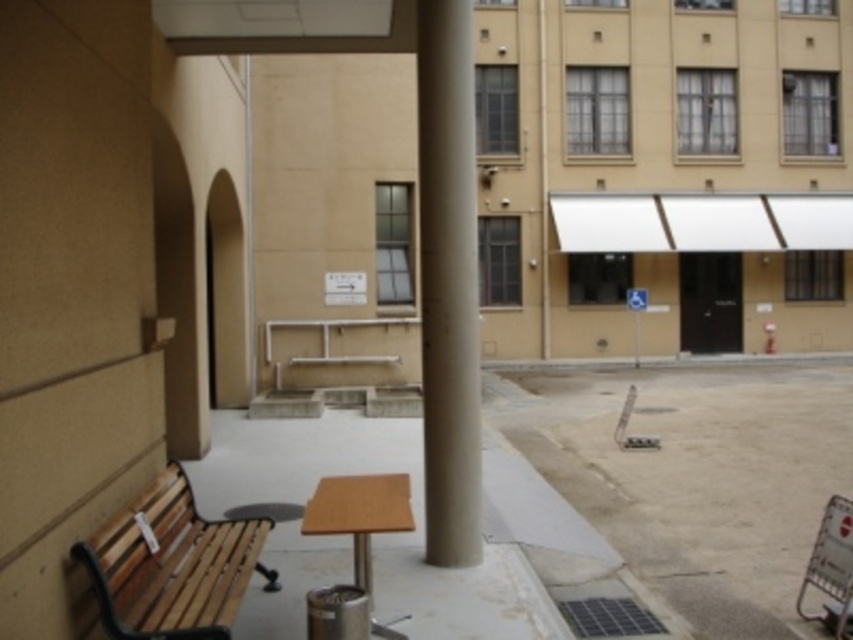
Question: Which of the following is the farthest from the observer?

Choices:
 (A) (387, 529)
 (B) (140, 579)

Answer: (B)

Question: Can you confirm if smooth concrete pavement at center is positioned to the right of smooth concrete pillar at center?

Choices:
 (A) yes
 (B) no

Answer: (A)

Question: Among these objects, which one is farthest from the camera?

Choices:
 (A) wooden park bench at lower left
 (B) smooth concrete pavement at center

Answer: (B)

Question: Is wooden park bench at lower left smaller than wooden table at center?

Choices:
 (A) yes
 (B) no

Answer: (A)

Question: Is smooth concrete pillar at center closer to camera compared to wooden park bench at lower left?

Choices:
 (A) no
 (B) yes

Answer: (A)

Question: Which is nearer to the smooth concrete pillar at center?

Choices:
 (A) wooden park bench at lower left
 (B) wooden table at center
 (C) smooth concrete pavement at center

Answer: (B)